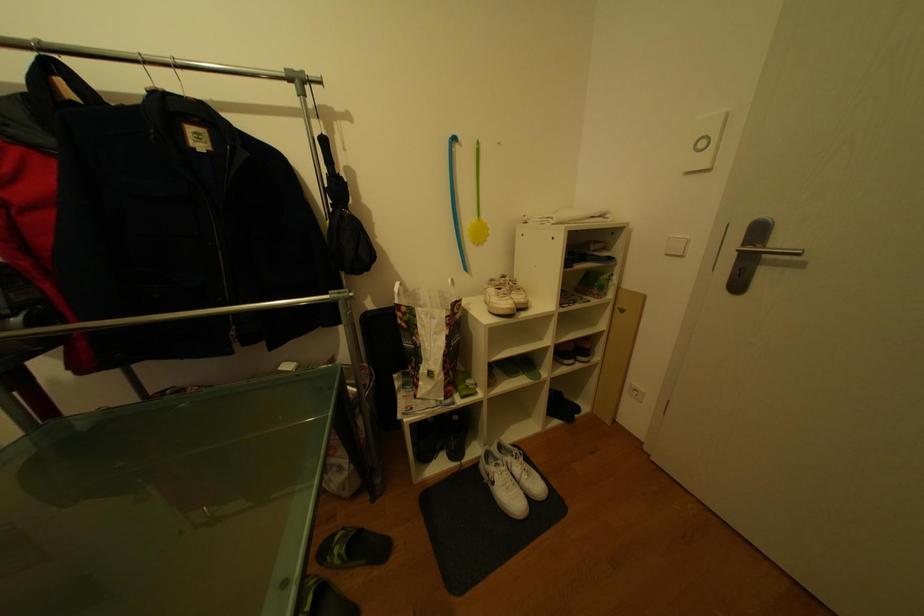
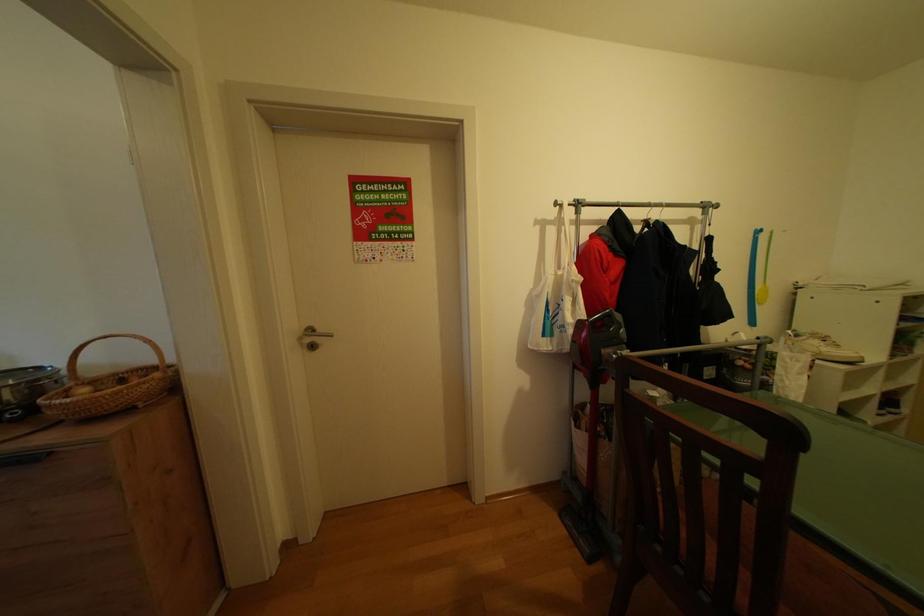
Question: The images are taken continuously from a first-person perspective. In which direction are you moving?

Choices:
 (A) Left
 (B) Right
 (C) Forward
 (D) Backward

Answer: (A)